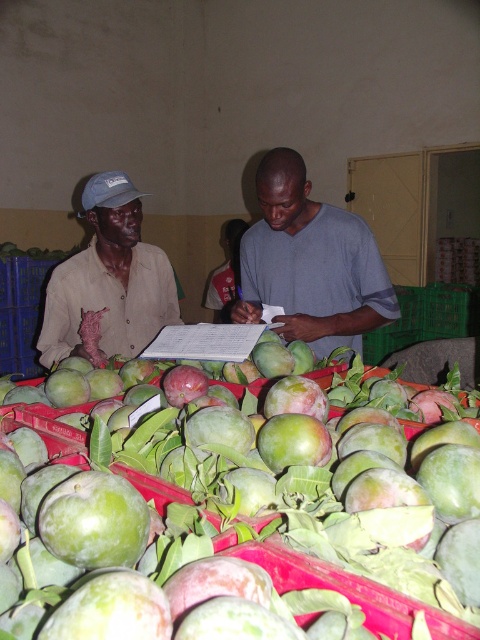
Question: Does green matte mangoes at center appear on the right side of gray matte shirt at center?

Choices:
 (A) yes
 (B) no

Answer: (B)

Question: Estimate the real-world distances between objects in this image. Which object is closer to the matte khaki shirt at left?

Choices:
 (A) green matte mangoes at center
 (B) gray matte shirt at center

Answer: (B)

Question: In this image, where is green matte mangoes at center located relative to matte khaki shirt at left?

Choices:
 (A) below
 (B) above

Answer: (A)

Question: Which object appears farthest from the camera in this image?

Choices:
 (A) gray matte shirt at center
 (B) matte khaki shirt at left
 (C) green matte mangoes at center

Answer: (A)

Question: Which point is closer to the camera taking this photo?

Choices:
 (A) (256, 236)
 (B) (47, 317)
 (C) (310, 508)

Answer: (C)

Question: Is green matte mangoes at center in front of gray matte shirt at center?

Choices:
 (A) no
 (B) yes

Answer: (B)